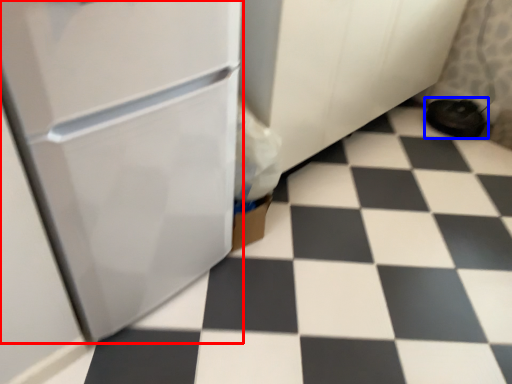
Question: Among these objects, which one is nearest to the camera, refrigerator (highlighted by a red box) or footwear (highlighted by a blue box)?

Choices:
 (A) refrigerator
 (B) footwear

Answer: (A)